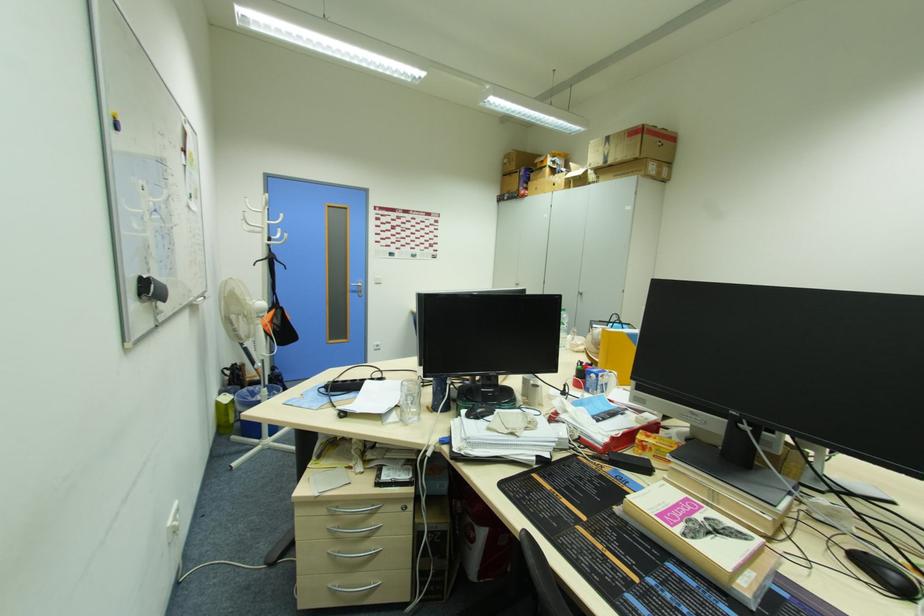
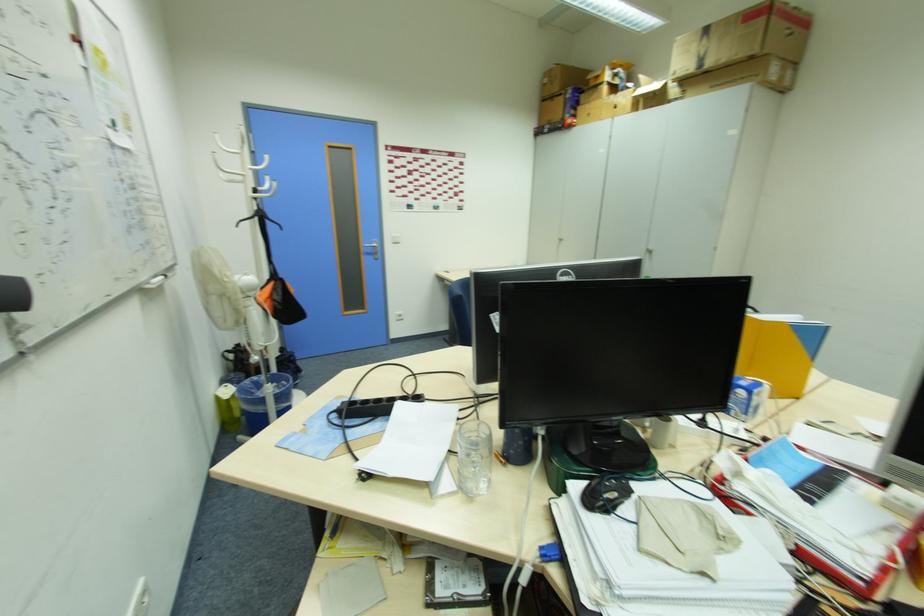
The point at [249,391] is marked in the first image. Where is the corresponding point in the second image?

(249, 383)